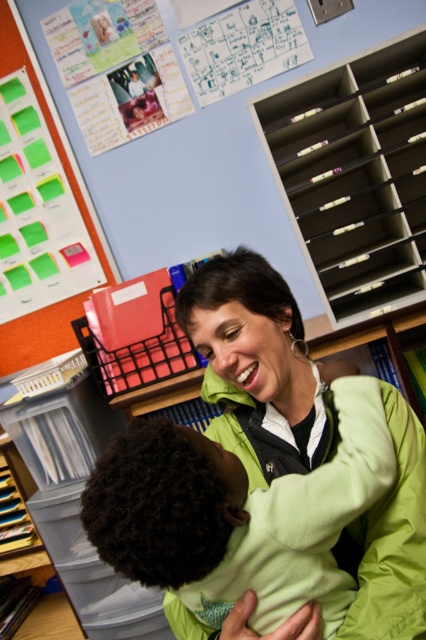
You are a student who needs to reach a book located on the gray plastic bookshelf at upper right. You are currently standing in front of the green fleece jacket at center. Can you see the bookshelf from your current position?

The green fleece jacket at center is in front of the gray plastic bookshelf at upper right, so the bookshelf is partially or fully blocked from your view. Move around the jacket to access the bookshelf.